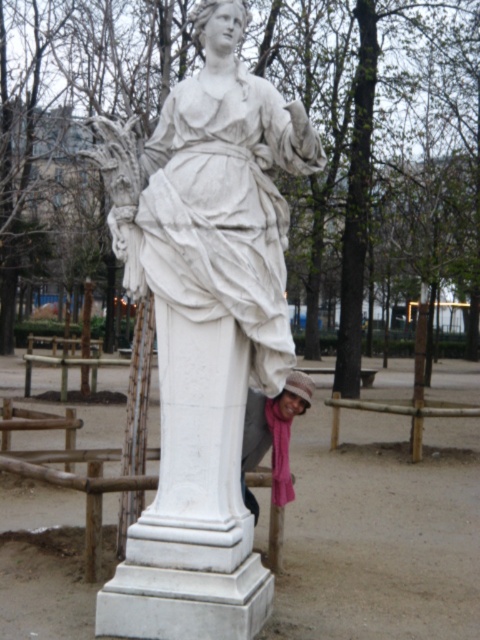
Question: Which point is closer to the camera?

Choices:
 (A) pink fabric scarf at lower center
 (B) white marble pillar at center
 (C) white marble statue at center

Answer: (C)

Question: Is white marble pillar at center thinner than pink fabric scarf at lower center?

Choices:
 (A) no
 (B) yes

Answer: (A)

Question: Which point appears farthest from the camera in this image?

Choices:
 (A) (255, 504)
 (B) (162, 634)
 (C) (224, 579)

Answer: (A)

Question: Considering the relative positions of white marble statue at center and pink fabric scarf at lower center in the image provided, where is white marble statue at center located with respect to pink fabric scarf at lower center?

Choices:
 (A) right
 (B) left

Answer: (B)

Question: Can you confirm if white marble pillar at center is positioned below pink fabric scarf at lower center?

Choices:
 (A) yes
 (B) no

Answer: (B)

Question: Which point is farther to the camera?

Choices:
 (A) (285, 390)
 (B) (207, 486)

Answer: (A)